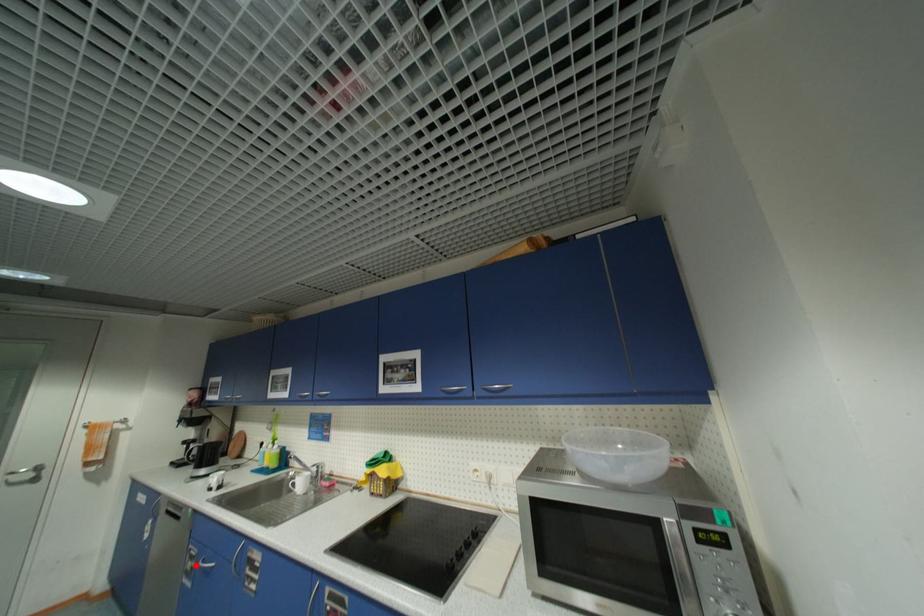
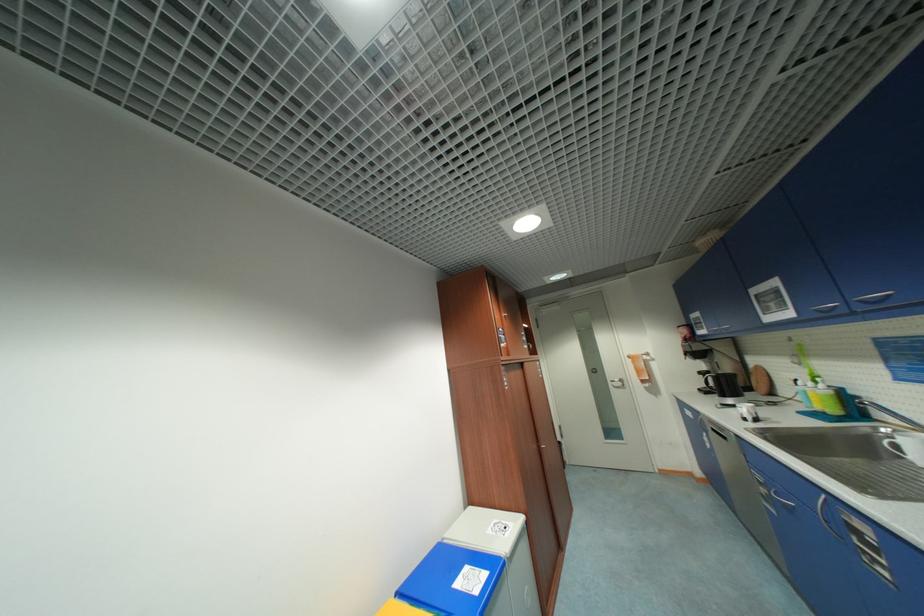
Question: I am providing you with two images of the same scene from different viewpoints. A red point is shown in image1. For the corresponding object point in image2, is it positioned nearer or farther from the camera?

Choices:
 (A) Nearer
 (B) Farther

Answer: (B)